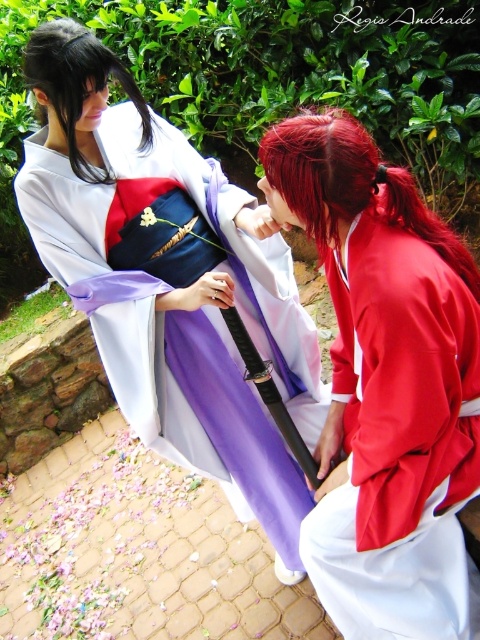
Based on the scene description, which object is positioned higher up in the image between the matte red kimono at center and the black silky hair at upper left?

The matte red kimono at center is taller than the black silky hair at upper left, so it is positioned higher up in the image.

You are an observer standing in front of the scene. You notice the matte red kimono at center and the black silky hair at upper left. Which object is positioned higher in the image?

The black silky hair at upper left is positioned higher in the image than the matte red kimono at center.